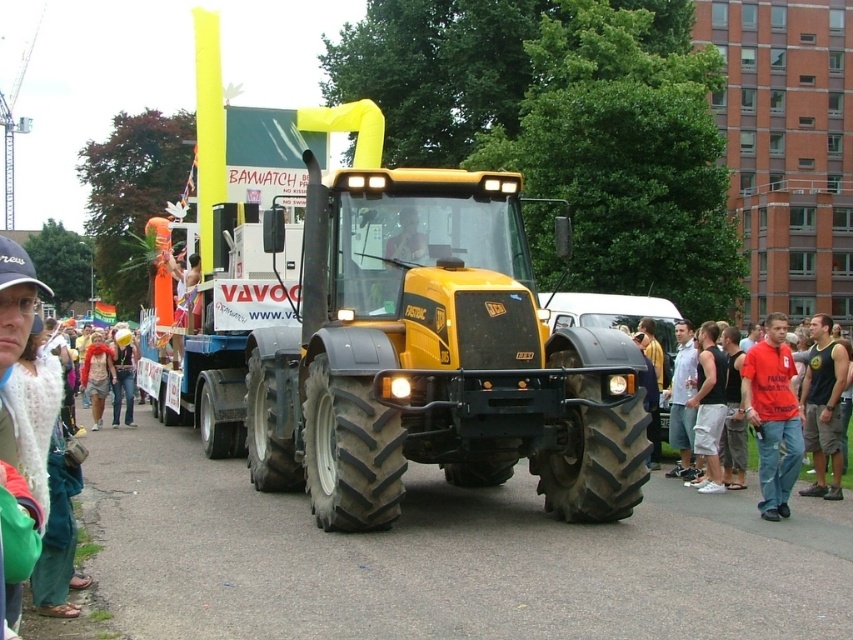
Question: Is yellow matte tractor at center to the left of red cotton shirt at lower right from the viewer's perspective?

Choices:
 (A) yes
 (B) no

Answer: (A)

Question: Is red cotton shirt at lower right to the left of white cotton shirt at center from the viewer's perspective?

Choices:
 (A) yes
 (B) no

Answer: (B)

Question: Which point appears closest to the camera in this image?

Choices:
 (A) (543, 349)
 (B) (820, 444)
 (C) (764, 340)

Answer: (A)

Question: Which of the following is the closest to the observer?

Choices:
 (A) red cotton shirt at lower right
 (B) black tank top at right
 (C) yellow matte tractor at center

Answer: (C)

Question: Which point is closer to the camera?

Choices:
 (A) red cotton shirt at lower right
 (B) black tank top at right
 (C) yellow matte tractor at center

Answer: (C)

Question: Is yellow matte tractor at center below black tank top at right?

Choices:
 (A) yes
 (B) no

Answer: (B)